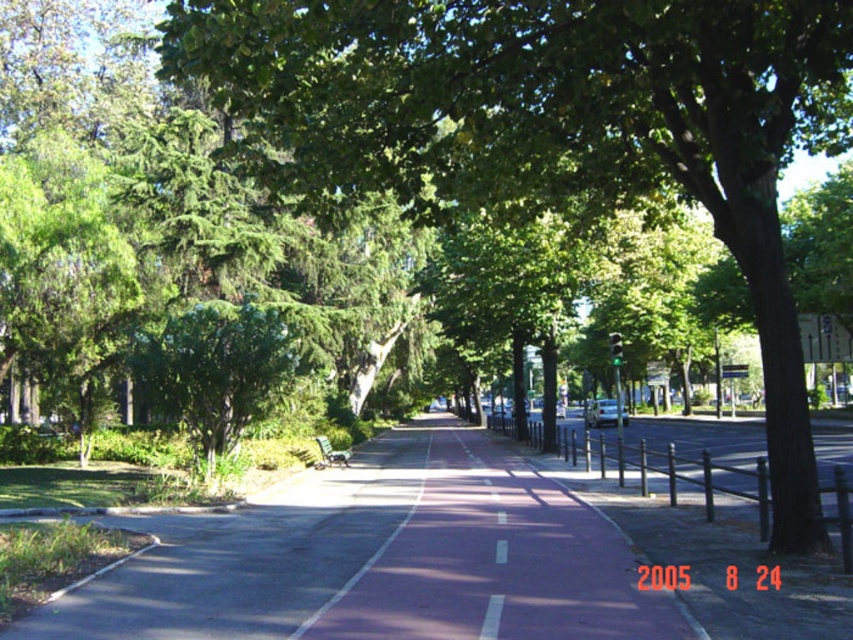
You are a city planner analyzing the park layout. Which object, the green leafy tree at center or the pink asphalt path at center, occupies more space in the scene?

The green leafy tree at center is bigger than the pink asphalt path at center, so it occupies more space in the scene.